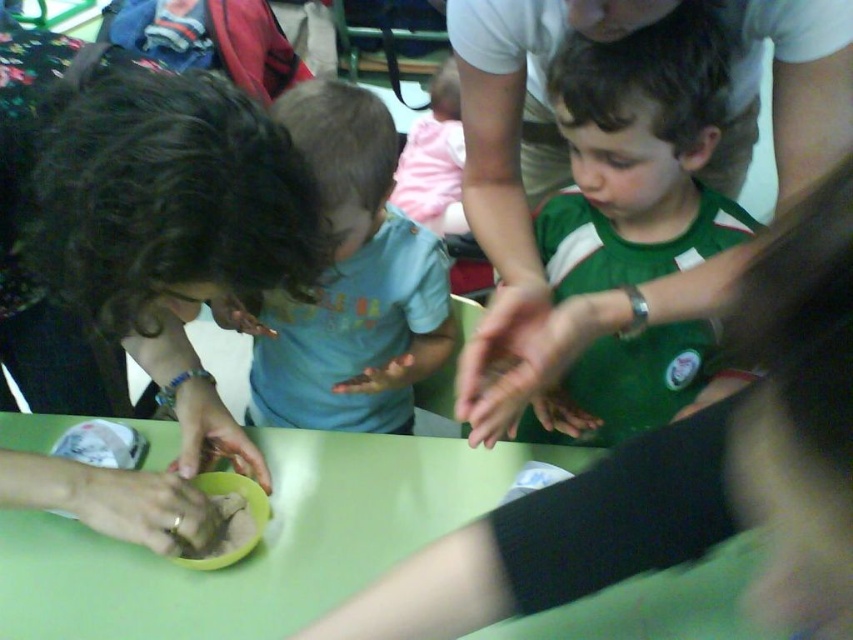
Question: Which of these objects is positioned closest to the green jersey at center?

Choices:
 (A) smooth beige hand at lower left
 (B) matte brown clay at lower left

Answer: (B)

Question: Which point appears farthest from the camera in this image?

Choices:
 (A) (183, 545)
 (B) (73, 474)

Answer: (A)

Question: Can you confirm if green glossy table at center is positioned above brown clay bowl at center?

Choices:
 (A) no
 (B) yes

Answer: (A)

Question: Where is curly hair at left located in relation to brown clay bowl at center in the image?

Choices:
 (A) right
 (B) left

Answer: (B)

Question: Is green glossy table at center to the right of green jersey at center from the viewer's perspective?

Choices:
 (A) yes
 (B) no

Answer: (B)

Question: Among these objects, which one is farthest from the camera?

Choices:
 (A) brown clay bowl at center
 (B) matte blue shirt at center
 (C) smooth beige hand at lower left
 (D) green glossy table at center

Answer: (A)